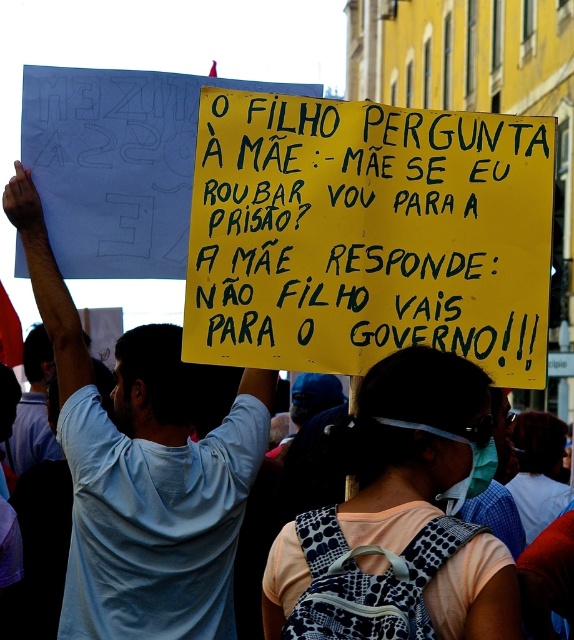
Is yellow paper sign at center shorter than light blue t-shirt at upper left?

Yes, yellow paper sign at center is shorter than light blue t-shirt at upper left.

Image resolution: width=574 pixels, height=640 pixels. Describe the element at coordinates (367, 236) in the screenshot. I see `yellow paper sign at center` at that location.

Find the location of a particular element. yellow paper sign at center is located at coordinates (367, 236).